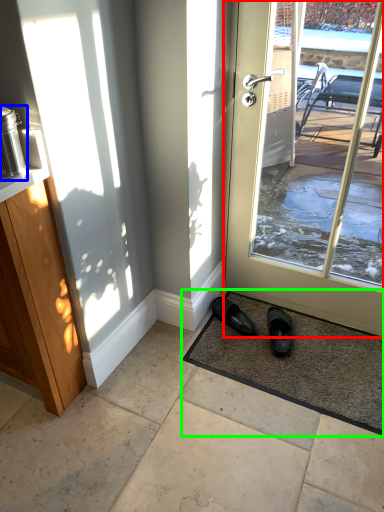
Question: Which is nearer to the door (highlighted by a red box)? appliance (highlighted by a blue box) or mat (highlighted by a green box).

Choices:
 (A) appliance
 (B) mat

Answer: (B)